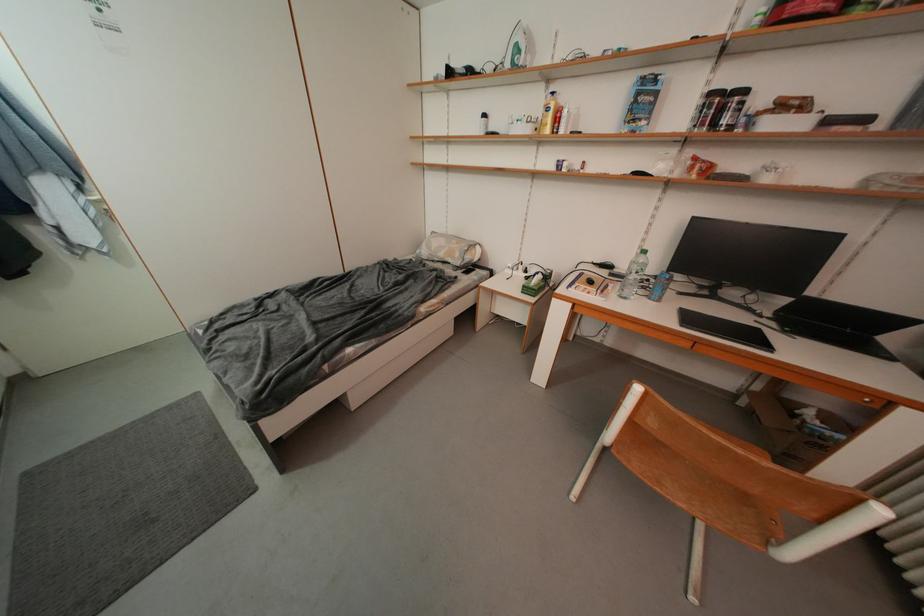
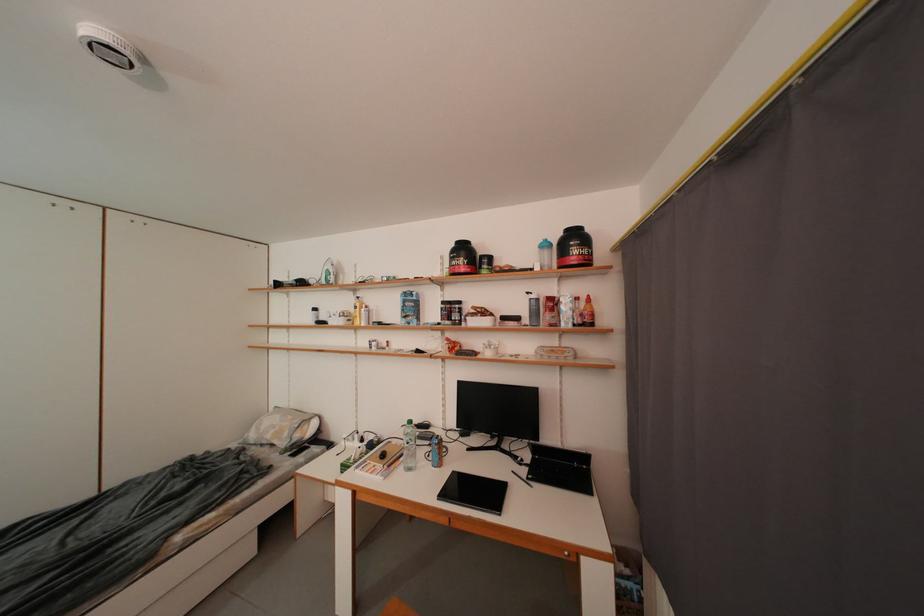
The point at (465, 257) is marked in the first image. Where is the corresponding point in the second image?

(294, 438)